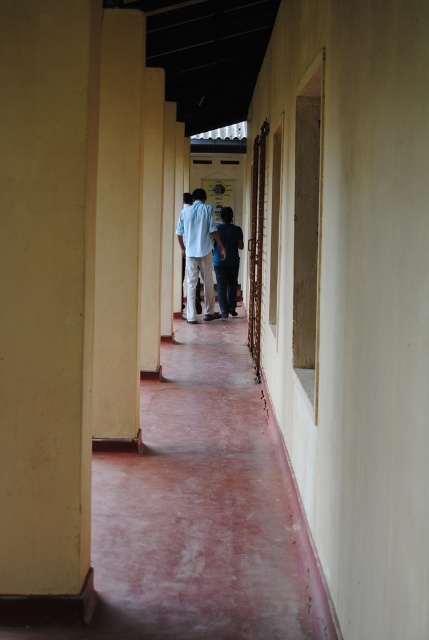
You are standing in the corridor and see the point marked at coordinates (x=47, y=300). Based on the scene description, can you identify which object this point is located on?

The point at coordinates (x=47, y=300) is located on the yellow matte pillar at left.